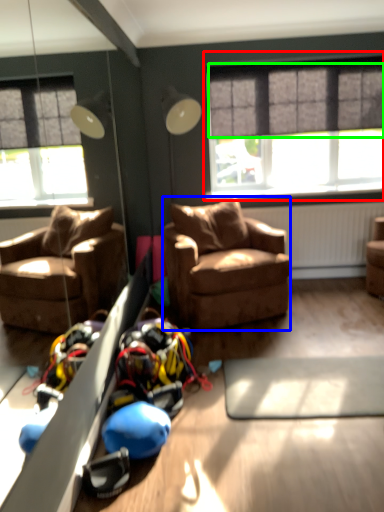
Question: Which object is positioned closest to window (highlighted by a red box)? Select from studio couch (highlighted by a blue box) and curtain (highlighted by a green box).

Choices:
 (A) studio couch
 (B) curtain

Answer: (B)